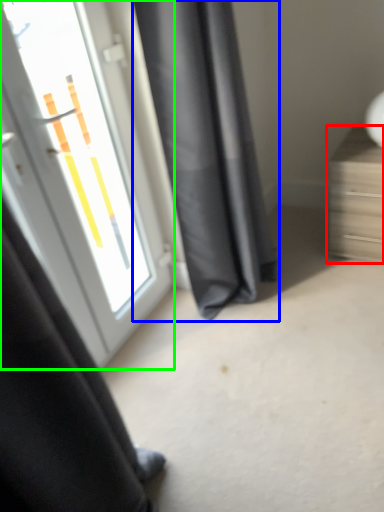
Question: Based on their relative distances, which object is farther from furniture (highlighted by a red box)? Choose from curtain (highlighted by a blue box) and door (highlighted by a green box).

Choices:
 (A) curtain
 (B) door

Answer: (B)